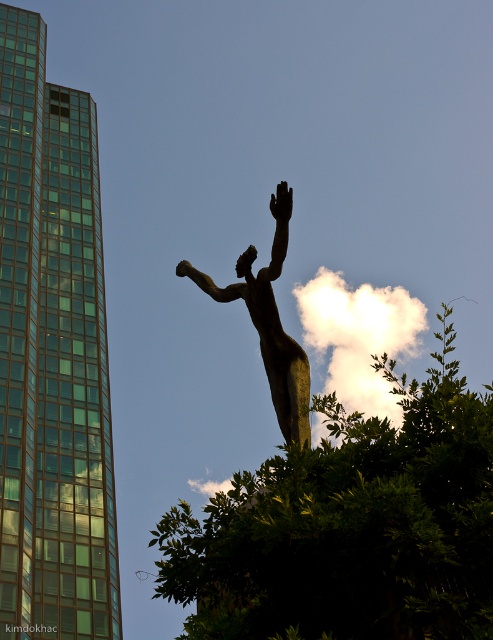
From the picture: Can you confirm if green leafy tree at center is positioned to the right of black matte hand at upper center?

Indeed, green leafy tree at center is positioned on the right side of black matte hand at upper center.

The height and width of the screenshot is (640, 493). What do you see at coordinates (350, 525) in the screenshot?
I see `green leafy tree at center` at bounding box center [350, 525].

Who is more forward, [458,490] or [287,195]?

Positioned in front is point [458,490].

Locate an element on the screen. The image size is (493, 640). green leafy tree at center is located at coordinates coord(350,525).

Is green leafy tree at center further to the viewer compared to bronze statue at center?

No, it is not.

Between green leafy tree at center and bronze statue at center, which one has less height?

Standing shorter between the two is bronze statue at center.

This screenshot has height=640, width=493. Identify the location of green leafy tree at center. tap(350, 525).

Who is taller, black matte hand at upper center or bronze at center?

Standing taller between the two is bronze at center.

Where is `black matte hand at upper center`? This screenshot has width=493, height=640. black matte hand at upper center is located at coordinates (281, 202).

At what (x,y) coordinates should I click in order to perform the action: click on black matte hand at upper center. Please return your answer as a coordinate pair (x, y). This screenshot has height=640, width=493. Looking at the image, I should click on (x=281, y=202).